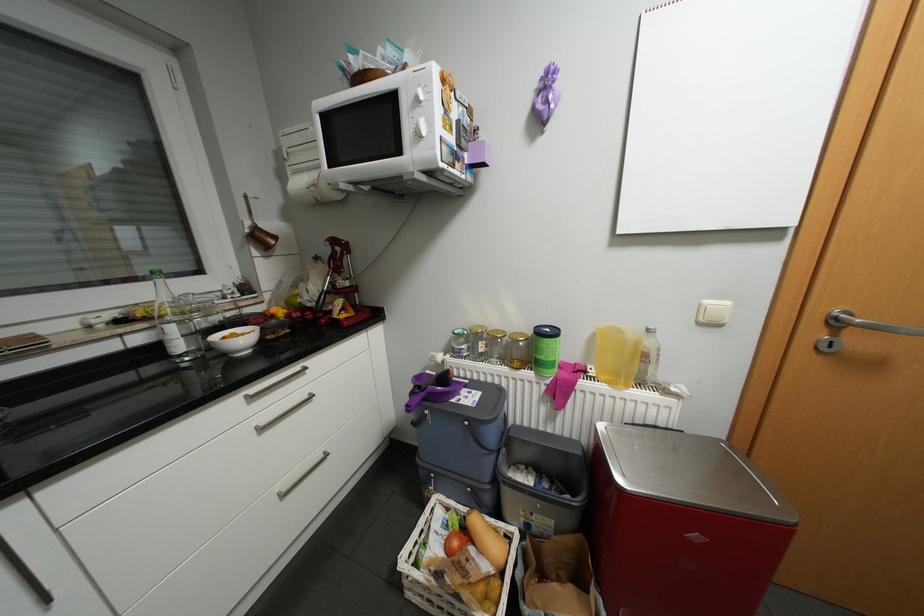
The width and height of the screenshot is (924, 616). In order to click on paper towel roll in this screenshot , I will do `click(311, 188)`.